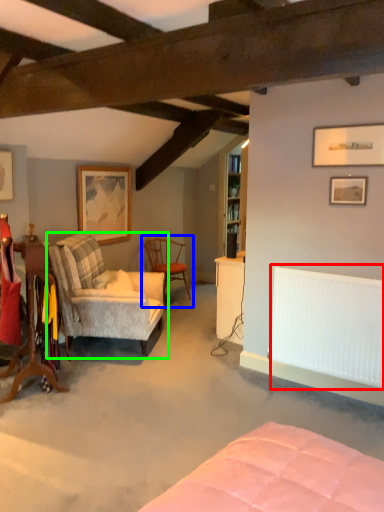
Question: Estimate the real-world distances between objects in this image. Which object is farther from radiator (highlighted by a red box), chair (highlighted by a blue box) or chair (highlighted by a green box)?

Choices:
 (A) chair
 (B) chair

Answer: (A)